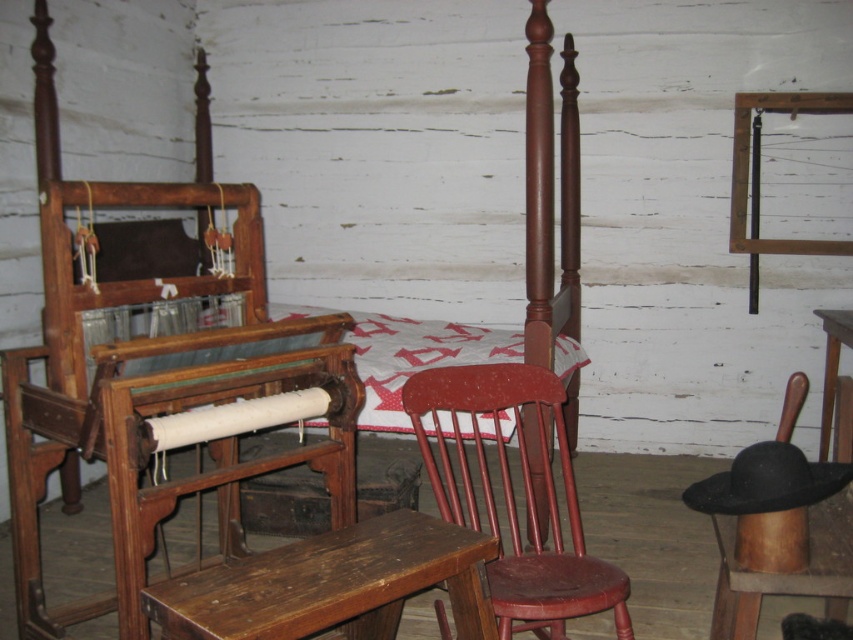
Question: Which point appears closest to the camera in this image?

Choices:
 (A) (560, 385)
 (B) (416, 333)
 (C) (828, 326)
 (D) (229, 600)

Answer: (D)

Question: Among these objects, which one is nearest to the camera?

Choices:
 (A) white quilted fabric at center
 (B) wooden table at lower right
 (C) matte red wooden chair at center
 (D) wooden bench at center

Answer: (D)

Question: Which point is closer to the camera?

Choices:
 (A) wooden bench at center
 (B) white quilted fabric at center
 (C) wooden table at lower right

Answer: (A)

Question: Can you confirm if white quilted fabric at center is smaller than wooden table at lower right?

Choices:
 (A) yes
 (B) no

Answer: (B)

Question: Does matte red wooden chair at center lie in front of white quilted fabric at center?

Choices:
 (A) yes
 (B) no

Answer: (A)

Question: Is matte red wooden chair at center to the right of wooden table at lower right from the viewer's perspective?

Choices:
 (A) yes
 (B) no

Answer: (B)